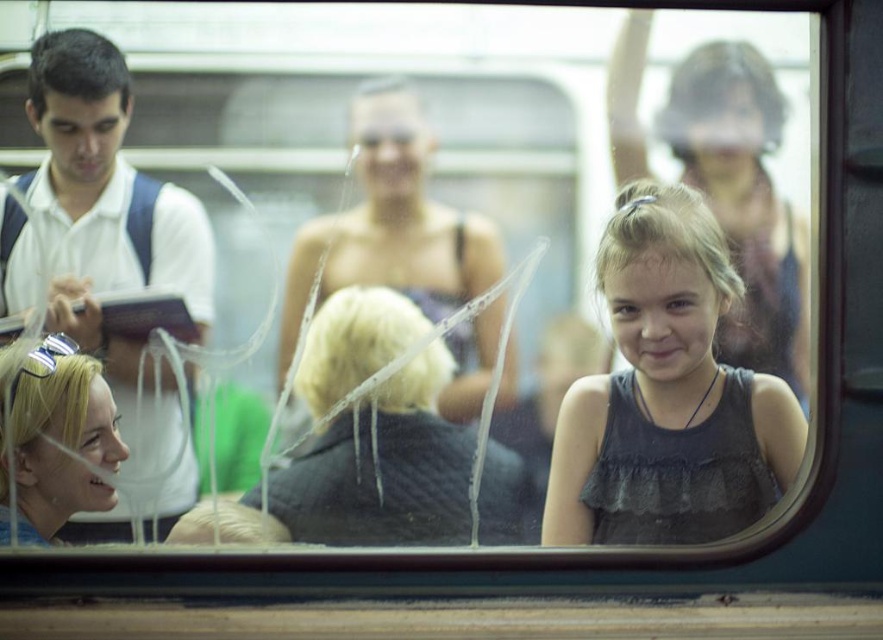
You are a photographer trying to capture the scene through the cracked window. The point at coordinates point (110, 225) is important for focusing. What object is located at that point?

The point (110, 225) indicates the white shirt at left.

You are a photographer trying to capture a clear shot of the dark gray textured sweater at center and the blonde hair at lower left. Based on their positions, which object is wider in the frame?

The dark gray textured sweater at center is wider than the blonde hair at lower left according to the description.